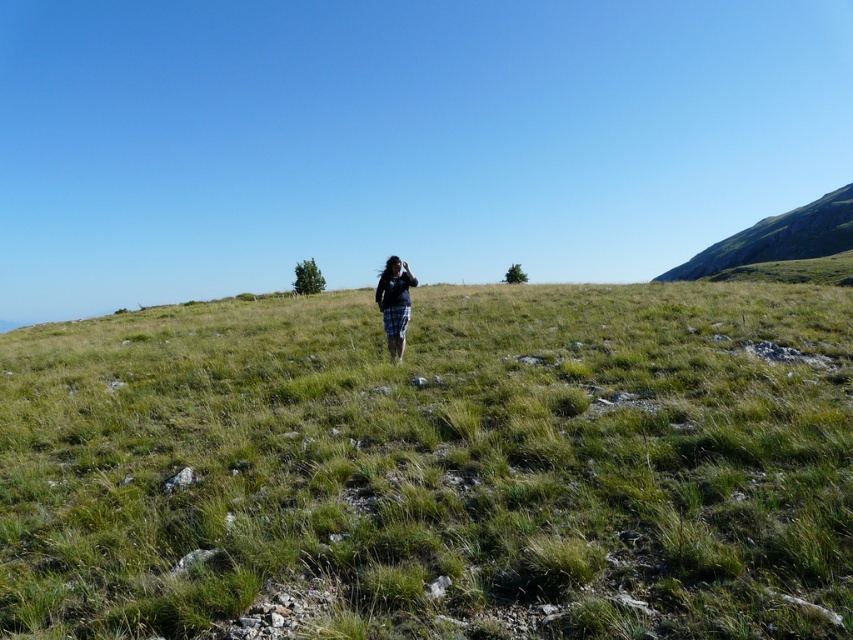
You are a photographer aiming to capture a clear shot of the plaid skirt at center. However, the green grassy at center is obstructing the view. Can you determine if the grass is taller than the skirt, making it harder to see the skirt?

The green grassy at center is much taller than the plaid skirt at center, so yes, the grass is obstructing the view of the skirt.

You are a drone operator trying to capture a photo of the green grassy at center and plaid skirt at center in the image. The camera has a minimum focus distance of 15 feet. Will both subjects be in focus if you set the focus to 16 feet?

The green grassy at center and plaid skirt at center are 16.15 feet apart from each other. If the focus is set to 16 feet, the minimum focus distance is 15 feet, so both subjects will be within the focus range and thus in focus.